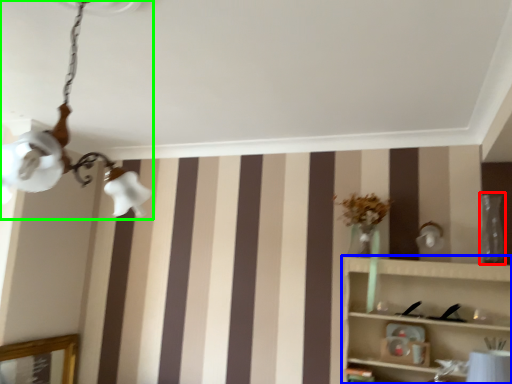
Question: Estimate the real-world distances between objects in this image. Which object is closer to glass vase (highlighted by a red box), shelf (highlighted by a blue box) or lamp (highlighted by a green box)?

Choices:
 (A) shelf
 (B) lamp

Answer: (A)